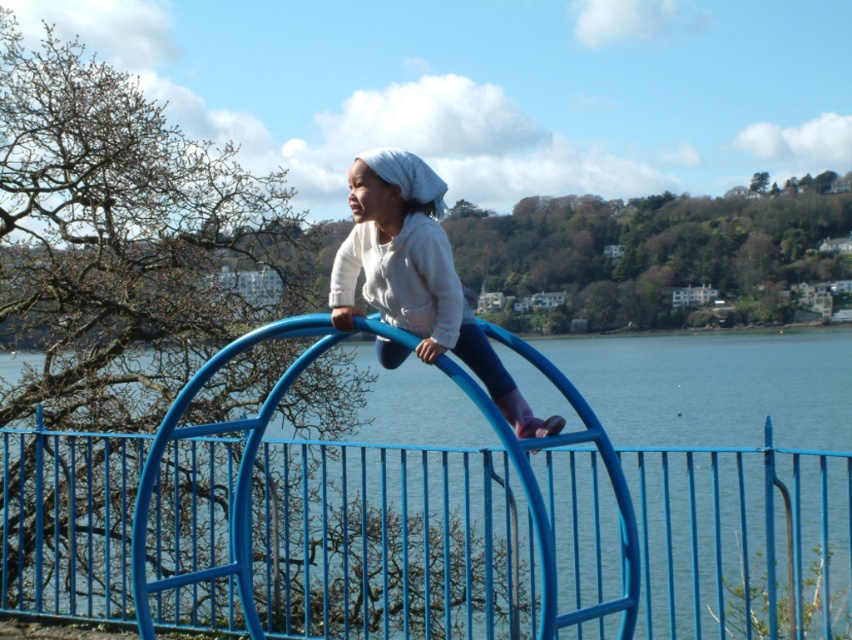
Is blue metal fence at center to the left of matte white hoodie at center from the viewer's perspective?

Indeed, blue metal fence at center is positioned on the left side of matte white hoodie at center.

Looking at this image, is blue metal fence at center below matte white hoodie at center?

Indeed, blue metal fence at center is positioned under matte white hoodie at center.

Is point (639, 500) positioned in front of point (384, 305)?

No.

Find the location of a particular element. blue metal fence at center is located at coordinates (426, 538).